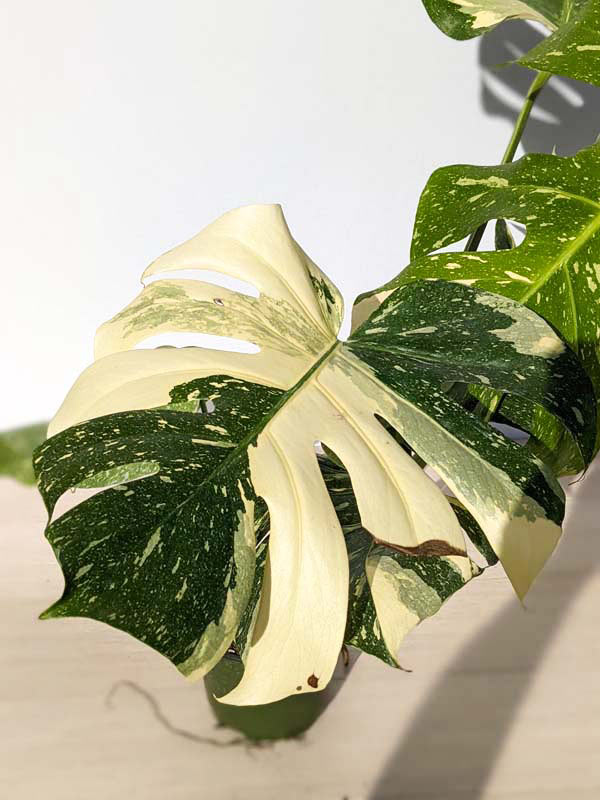
This screenshot has height=800, width=600. What are the coordinates of `thai constellation plant` in the screenshot? It's located at (240, 412).